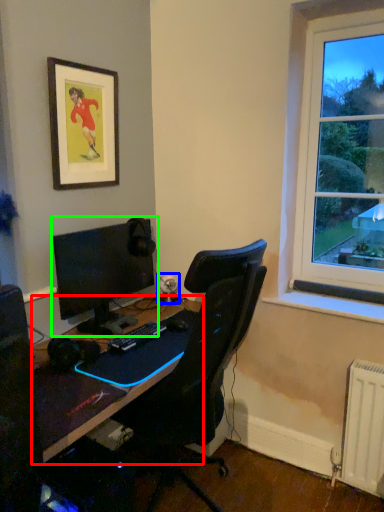
Question: Which object is positioned farthest from desk (highlighted by a red box)? Select from speaker (highlighted by a blue box) and computer monitor (highlighted by a green box).

Choices:
 (A) speaker
 (B) computer monitor

Answer: (A)